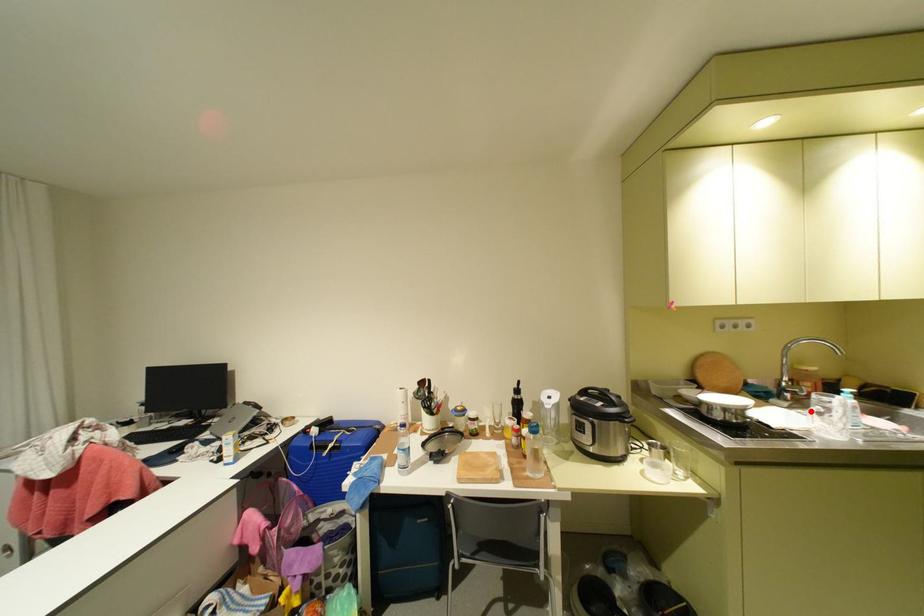
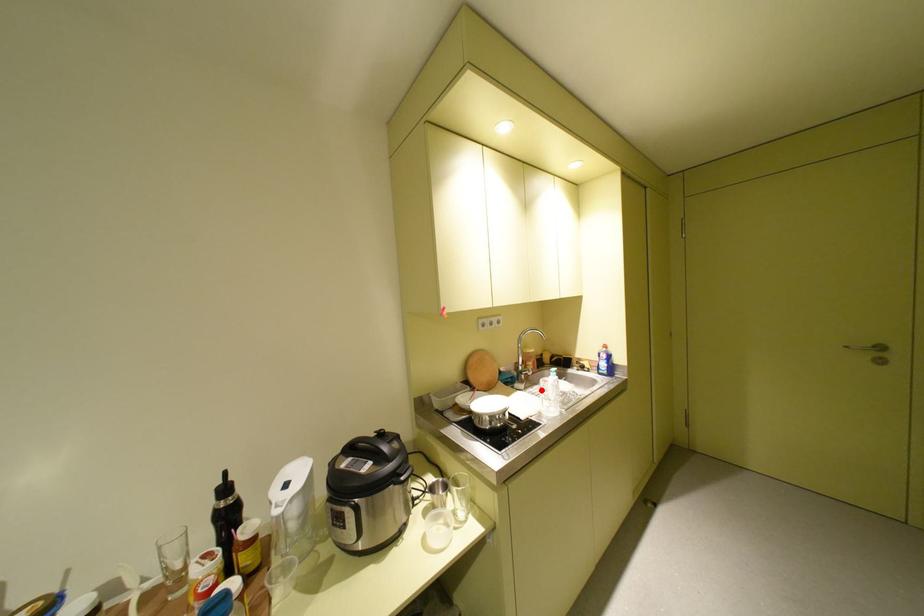
I am providing you with two images of the same scene from different viewpoints. A red point is marked on the first image and another point is marked on the second image. Does the point marked in image1 correspond to the same location as the one in image2?

Yes